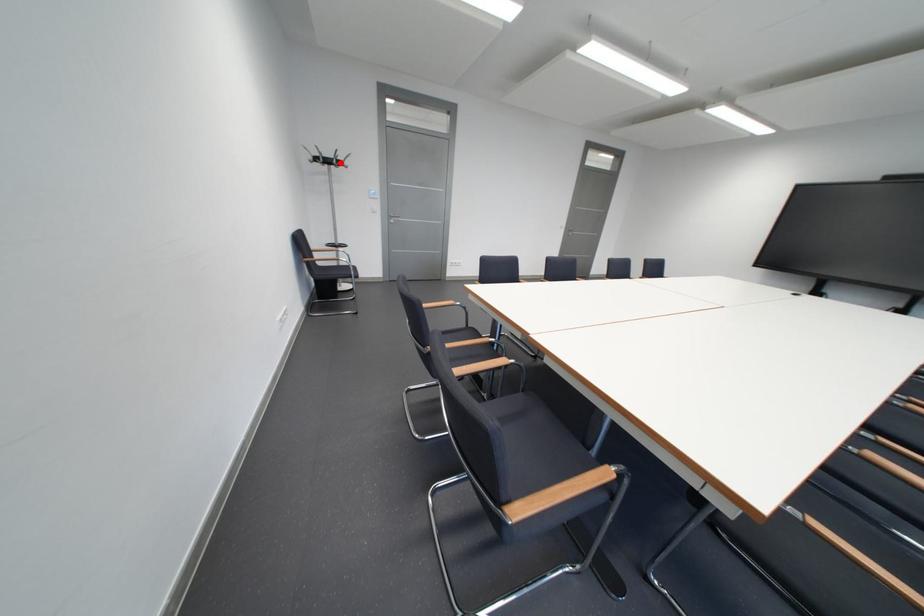
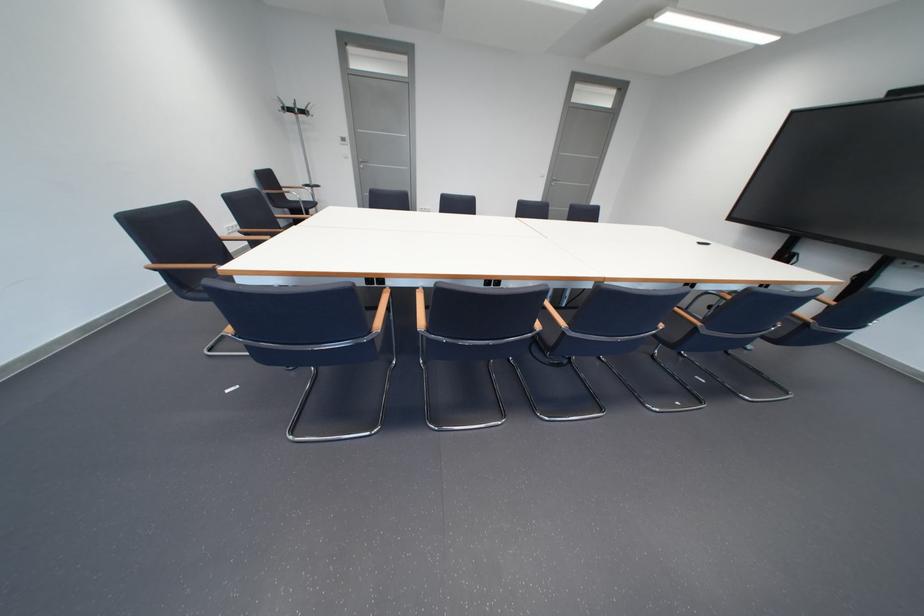
Question: I am providing you with two images of the same scene from different viewpoints. In image1, a red point is highlighted. Considering the same 3D point in image2, which of the following is correct?

Choices:
 (A) It is closer
 (B) It is farther

Answer: (B)